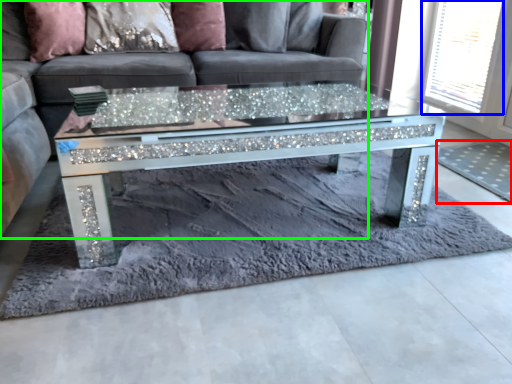
Question: Considering the real-world distances, which object is farthest from mat (highlighted by a red box)? window screen (highlighted by a blue box) or studio couch (highlighted by a green box)?

Choices:
 (A) window screen
 (B) studio couch

Answer: (B)